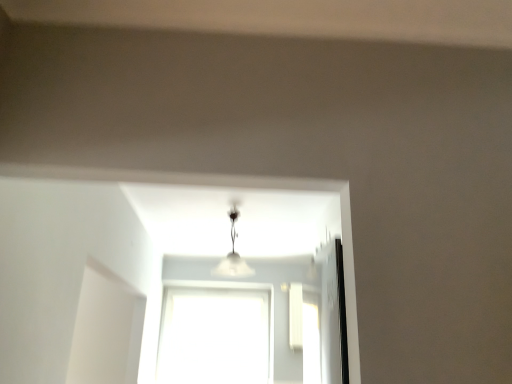
You are a GUI agent. You are given a task and a screenshot of the screen. Output one action in this format:
    pyautogui.click(x=<x>, y=<y>)
    Task: Click on the transparent glass window at center
    The height and width of the screenshot is (384, 512).
    Given the screenshot: What is the action you would take?
    pyautogui.click(x=214, y=336)

Describe the element at coordinates (214, 336) in the screenshot. I see `transparent glass window at center` at that location.

Describe the element at coordinates (233, 252) in the screenshot. The image size is (512, 384). I see `white frosted glass lamp at center` at that location.

The image size is (512, 384). What are the coordinates of `white frosted glass lamp at center` in the screenshot? It's located at (233, 252).

What are the coordinates of `transparent glass window at center` in the screenshot? It's located at [214, 336].

Which object is positioned more to the left, white frosted glass lamp at center or transparent glass window at center?

transparent glass window at center is more to the left.

Which is in front, white frosted glass lamp at center or transparent glass window at center?

Positioned in front is white frosted glass lamp at center.

Which is more distant, (223, 266) or (207, 345)?

The point (207, 345) is behind.

From the image's perspective, is white frosted glass lamp at center located above or below transparent glass window at center?

white frosted glass lamp at center is above transparent glass window at center.

From a real-world perspective, between white frosted glass lamp at center and transparent glass window at center, who is vertically lower?

transparent glass window at center.

Considering the sizes of white frosted glass lamp at center and transparent glass window at center in the image, is white frosted glass lamp at center wider or thinner than transparent glass window at center?

white frosted glass lamp at center is wider than transparent glass window at center.

Does white frosted glass lamp at center have a lesser height compared to transparent glass window at center?

Yes, white frosted glass lamp at center is shorter than transparent glass window at center.

Does white frosted glass lamp at center have a smaller size compared to transparent glass window at center?

Indeed, white frosted glass lamp at center has a smaller size compared to transparent glass window at center.

Would you say white frosted glass lamp at center contains transparent glass window at center?

Definitely not — transparent glass window at center is not inside white frosted glass lamp at center.

Is white frosted glass lamp at center far away from transparent glass window at center?

Yes, white frosted glass lamp at center and transparent glass window at center are located far from each other.

Is white frosted glass lamp at center aimed at transparent glass window at center?

No, white frosted glass lamp at center is not turned towards transparent glass window at center.

How distant is white frosted glass lamp at center from transparent glass window at center?

They are 6.10 feet apart.

Locate an element on the screen. Image resolution: width=512 pixels, height=384 pixels. window below the white frosted glass lamp at center (from a real-world perspective) is located at coordinates (214, 336).

Which is more to the left, transparent glass window at center or white frosted glass lamp at center?

Positioned to the left is transparent glass window at center.

Relative to white frosted glass lamp at center, is transparent glass window at center in front or behind?

Visually, transparent glass window at center is located behind white frosted glass lamp at center.

Between point (167, 382) and point (246, 263), which one is positioned behind?

The point (246, 263) is more distant.

From the image's perspective, is transparent glass window at center located above or below white frosted glass lamp at center?

Clearly, from the image's perspective, transparent glass window at center is below white frosted glass lamp at center.

From a real-world perspective, who is located lower, transparent glass window at center or white frosted glass lamp at center?

transparent glass window at center is physically lower.

Considering the relative sizes of transparent glass window at center and white frosted glass lamp at center in the image provided, is transparent glass window at center thinner than white frosted glass lamp at center?

Correct, the width of transparent glass window at center is less than that of white frosted glass lamp at center.

Which of these two, transparent glass window at center or white frosted glass lamp at center, stands taller?

Standing taller between the two is transparent glass window at center.

Considering the relative sizes of transparent glass window at center and white frosted glass lamp at center in the image provided, is transparent glass window at center bigger than white frosted glass lamp at center?

Yes, transparent glass window at center is bigger than white frosted glass lamp at center.

Would you say transparent glass window at center contains white frosted glass lamp at center?

No, white frosted glass lamp at center is not inside transparent glass window at center.

Are transparent glass window at center and white frosted glass lamp at center beside each other?

transparent glass window at center and white frosted glass lamp at center are not in contact.

Could you tell me if transparent glass window at center is turned towards white frosted glass lamp at center?

Yes.

Locate an element on the screen. This screenshot has width=512, height=384. lamp above the transparent glass window at center (from the image's perspective) is located at coordinates (233, 252).

You are a GUI agent. You are given a task and a screenshot of the screen. Output one action in this format:
    pyautogui.click(x=<x>, y=<y>)
    Task: Click on the lamp on the right of transparent glass window at center
    
    Given the screenshot: What is the action you would take?
    pyautogui.click(x=233, y=252)

The image size is (512, 384). Identify the location of window below the white frosted glass lamp at center (from a real-world perspective). (214, 336).